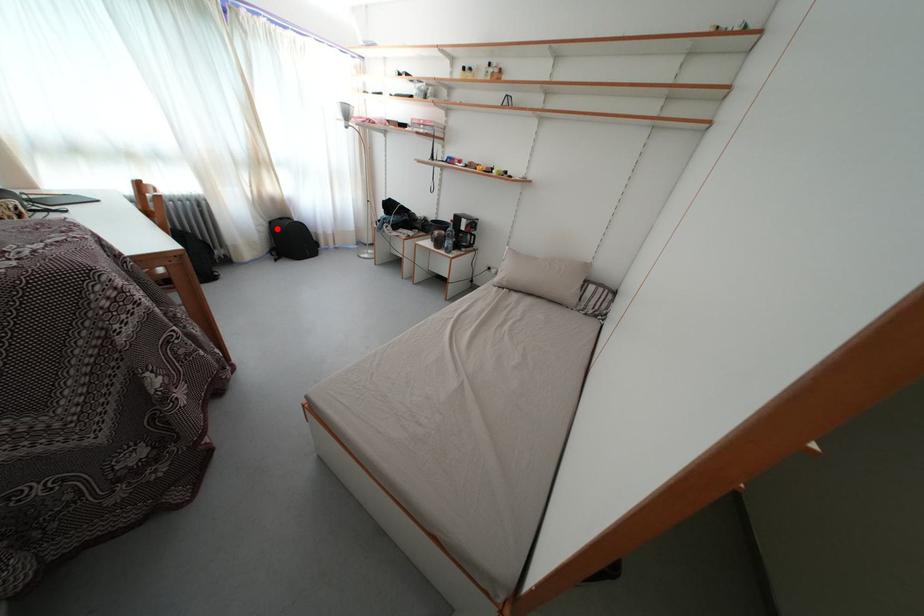
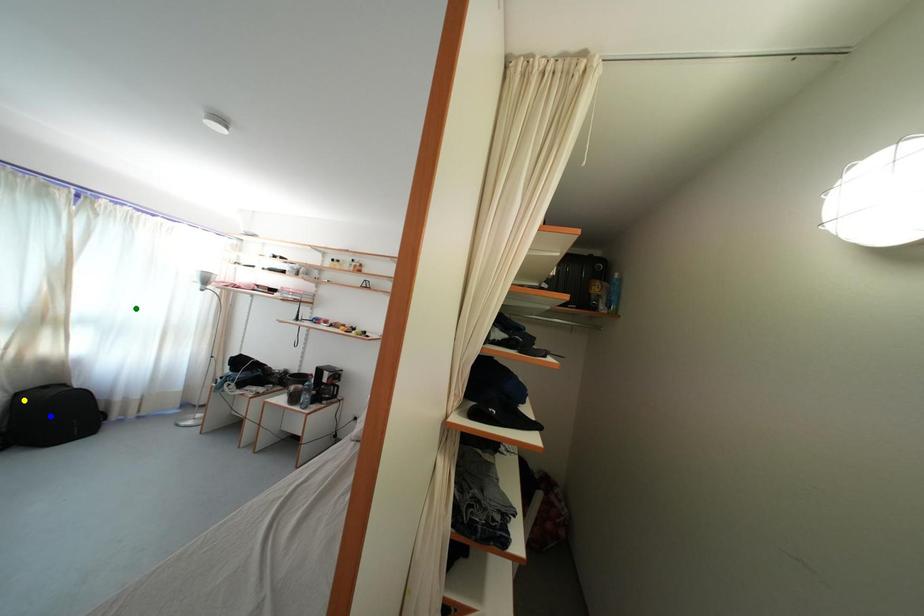
Question: I am providing you with two images of the same scene from different viewpoints. A red point is marked on the first image. You are given multiple points on the second image. Which spot in image 2 lines up with the point in image 1?

Choices:
 (A) blue point
 (B) yellow point
 (C) green point

Answer: (B)